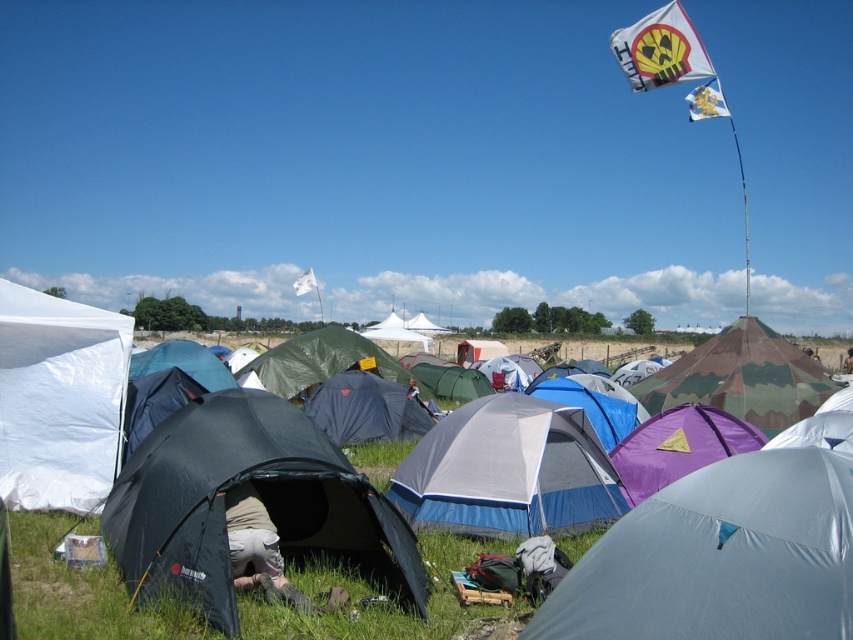
Question: Which point is closer to the camera taking this photo?

Choices:
 (A) (434, 468)
 (B) (749, 513)

Answer: (B)

Question: Which object is farther from the camera taking this photo?

Choices:
 (A) khaki fabric pants at center
 (B) black fabric tent at center
 (C) matte gray tent at center
 (D) white/blue fabric tent at center

Answer: (D)

Question: Does black fabric tent at center come in front of white/blue fabric tent at center?

Choices:
 (A) no
 (B) yes

Answer: (B)

Question: Is the position of matte gray tent at center less distant than that of white/blue fabric tent at center?

Choices:
 (A) yes
 (B) no

Answer: (A)

Question: Is white/blue fabric tent at center positioned in front of khaki fabric pants at center?

Choices:
 (A) no
 (B) yes

Answer: (A)

Question: Which point is farther from the camera taking this photo?

Choices:
 (A) (798, 560)
 (B) (117, 337)
 (C) (308, 605)

Answer: (B)